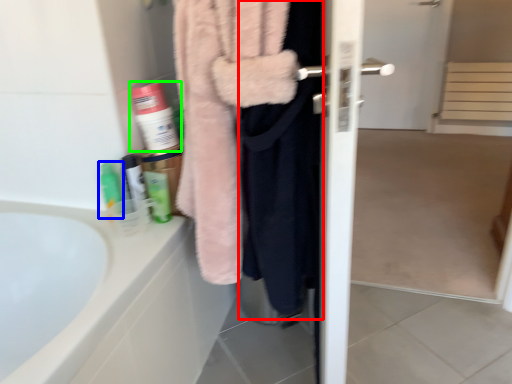
Question: Which is farther away from clothing (highlighted by a red box)? toiletry (highlighted by a blue box) or cleaning product (highlighted by a green box)?

Choices:
 (A) toiletry
 (B) cleaning product

Answer: (A)